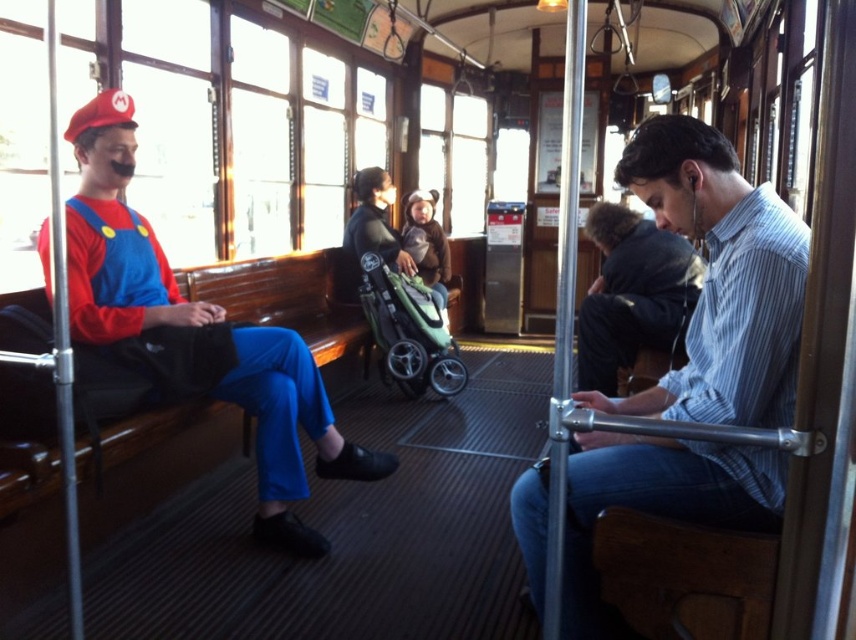
Question: Which object is closer to the camera taking this photo?

Choices:
 (A) striped cotton shirt at center
 (B) green fabric stroller at center
 (C) striped cotton shirt at right
 (D) matte blue jumpsuit at left

Answer: (C)

Question: Which is nearer to the matte blue jumpsuit at left?

Choices:
 (A) striped cotton shirt at right
 (B) green fabric stroller at center
 (C) striped cotton shirt at center

Answer: (A)

Question: Does matte blue jumpsuit at left appear on the right side of striped cotton shirt at center?

Choices:
 (A) yes
 (B) no

Answer: (B)

Question: Is striped cotton shirt at center to the right of green fabric stroller at center from the viewer's perspective?

Choices:
 (A) yes
 (B) no

Answer: (A)

Question: Can you confirm if matte blue jumpsuit at left is positioned to the right of striped cotton shirt at center?

Choices:
 (A) no
 (B) yes

Answer: (A)

Question: Which point is closer to the camera?

Choices:
 (A) coord(673,396)
 (B) coord(96,113)
 (C) coord(418,285)

Answer: (A)